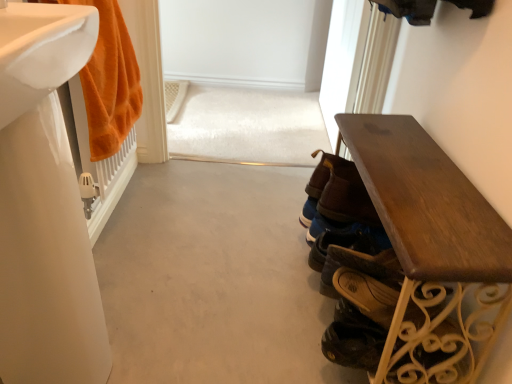
Question: Is brown leather shoe at lower right, which is counted as the 1th shoe, starting from the top, inside or outside of white glossy sink at left, which is the second sink from top to bottom?

Choices:
 (A) outside
 (B) inside

Answer: (A)

Question: Would you say brown leather shoe at lower right, which is counted as the 1th shoe, starting from the top, is to the left or to the right of white glossy sink at left, which is the first sink in bottom-to-top order, in the picture?

Choices:
 (A) left
 (B) right

Answer: (B)

Question: Which of these objects is positioned farthest from the shiny black shoe at lower right, the first shoe when ordered from bottom to top?

Choices:
 (A) brown leather shoes at center, the first footwear viewed from the back
 (B) brown leather shoe at lower right, positioned as the 1th footwear in front-to-back order
 (C) white glossy sink at left, which is the second sink from top to bottom
 (D) brown leather shoe at lower right, which is counted as the 1th shoe, starting from the top
 (E) orange plush towel at left

Answer: (E)

Question: Which is farther from the wooden bench at right?

Choices:
 (A) white glossy sink at left, the 2th sink when ordered from bottom to top
 (B) white glossy sink at left, which is the second sink from top to bottom
 (C) brown leather shoe at lower right, which is counted as the 1th shoe, starting from the top
 (D) brown leather shoe at lower right, positioned as the 1th footwear in front-to-back order
 (E) shiny black shoe at lower right, which is counted as the second shoe, starting from the top

Answer: (A)